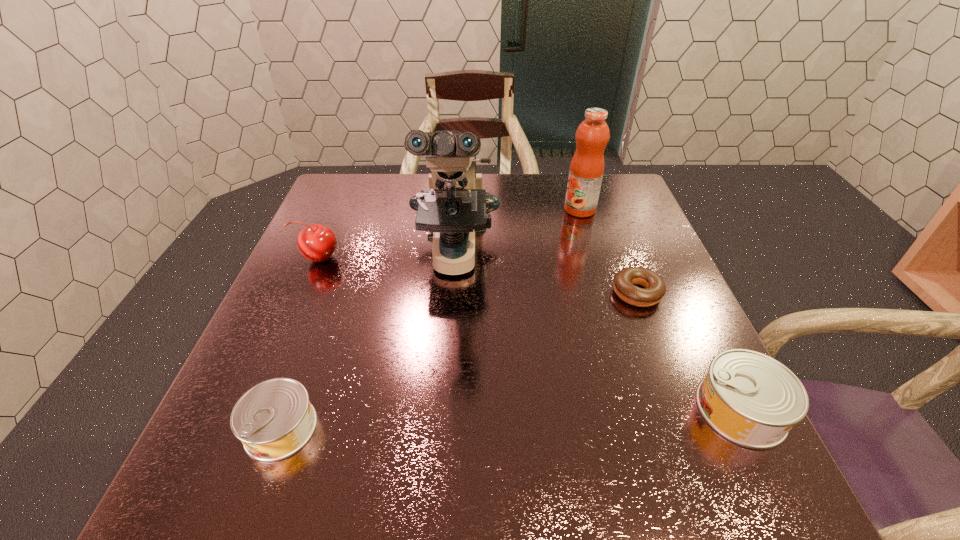
The width and height of the screenshot is (960, 540). Find the location of `the second shortest object`. the second shortest object is located at coordinates (274, 419).

Find the location of a particular element. This screenshot has width=960, height=540. the left can is located at coordinates (274, 419).

Identify the location of the right can. coord(751,399).

Identify the location of the taller can. This screenshot has height=540, width=960. (751, 399).

The height and width of the screenshot is (540, 960). What are the coordinates of `fruit juice` in the screenshot? It's located at (586, 171).

Find the location of a particular element. Image resolution: width=960 pixels, height=540 pixels. cherry is located at coordinates (317, 243).

You are a GUI agent. You are given a task and a screenshot of the screen. Output one action in this format:
    pyautogui.click(x=<x>, y=<y>)
    Task: Click on the doughnut
    This screenshot has height=540, width=960.
    Given the screenshot: What is the action you would take?
    pyautogui.click(x=654, y=289)

Locate an element on the screen. Image resolution: width=960 pixels, height=540 pixels. microscope is located at coordinates coord(454,207).

Identify the location of the third object from left to right. (454, 207).

You are a GUI agent. You are given a task and a screenshot of the screen. Output one action in this format:
    pyautogui.click(x=<x>, y=<y>)
    Task: Click on the vacant point located 0.330m on the back of the left can
    This screenshot has width=960, height=540.
    Given the screenshot: What is the action you would take?
    pyautogui.click(x=336, y=275)